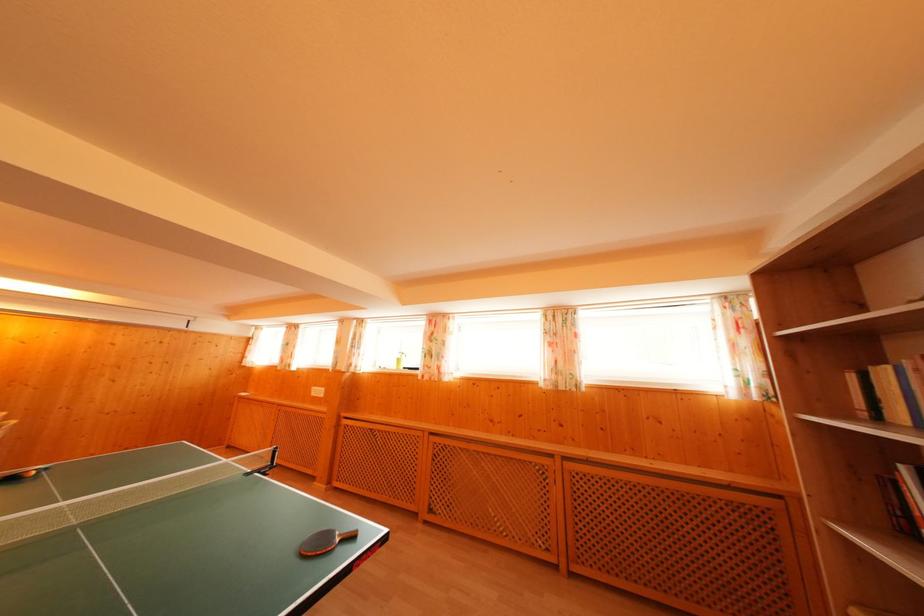
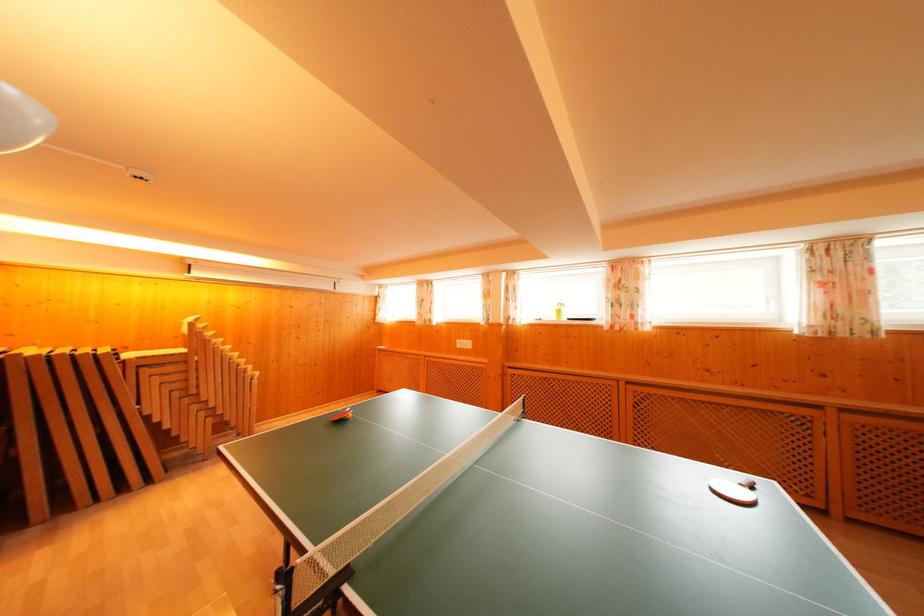
Question: What movement of the cameraman would produce the second image?

Choices:
 (A) Left
 (B) Right
 (C) Forward
 (D) Backward

Answer: (A)